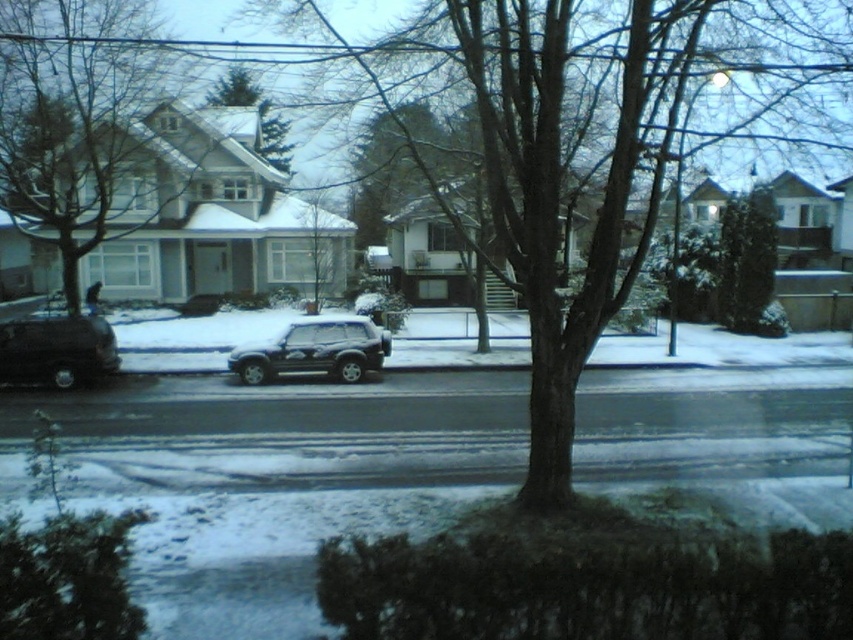
Question: Among these points, which one is farthest from the camera?

Choices:
 (A) (368, 342)
 (B) (115, 141)

Answer: (B)

Question: Estimate the real-world distances between objects in this image. Which object is closer to the green leafy tree at right?

Choices:
 (A) green matte tree at center
 (B) satin black suv at center
 (C) brown textured tree at center
 (D) smooth white tree at center

Answer: (C)

Question: Does shiny black suv at left have a smaller size compared to satin black suv at center?

Choices:
 (A) yes
 (B) no

Answer: (B)

Question: Does smooth white tree at center come in front of green leafy tree at right?

Choices:
 (A) no
 (B) yes

Answer: (B)

Question: Is brown textured tree at center smaller than satin black suv at center?

Choices:
 (A) yes
 (B) no

Answer: (B)

Question: Which point appears farthest from the camera in this image?

Choices:
 (A) (316, 280)
 (B) (741, 328)
 (C) (61, 122)
 (D) (267, 131)

Answer: (D)